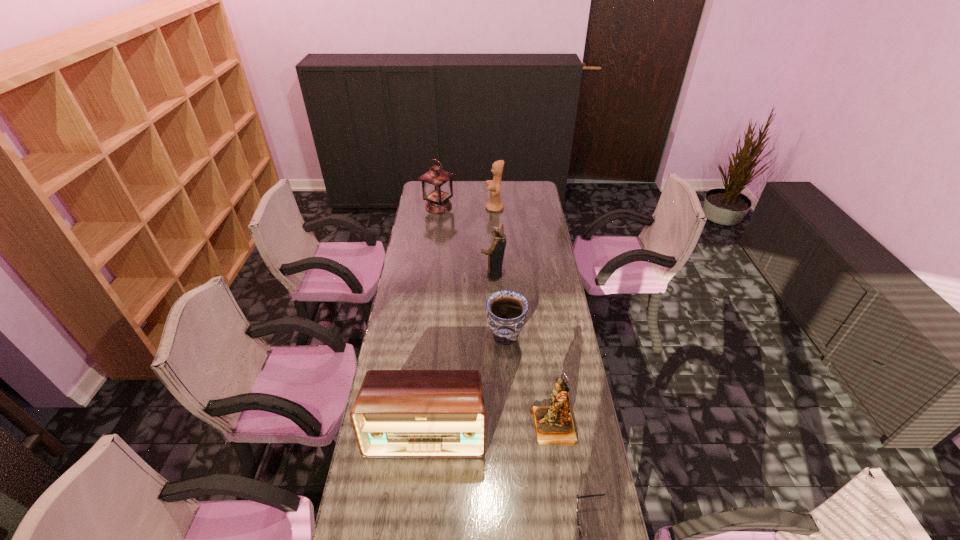
Image resolution: width=960 pixels, height=540 pixels. What are the coordinates of `vacant area between the oil lamp and the radio receiver` in the screenshot? It's located at (432, 320).

The height and width of the screenshot is (540, 960). What are the coordinates of `free spot between the oil lamp and the radio receiver` in the screenshot? It's located at (432, 320).

Where is `vacant space that is in between the radio receiver and the oil lamp`? vacant space that is in between the radio receiver and the oil lamp is located at coordinates (432, 320).

Select which object appears as the fifth closest to the farthest figurine. Please provide its 2D coordinates. Your answer should be formatted as a tuple, i.e. [(x, y)], where the tuple contains the x and y coordinates of a point satisfying the conditions above.

[(397, 413)]

I want to click on object that can be found as the third closest to the radio receiver, so click(x=581, y=539).

Locate an element on the screen. This screenshot has height=540, width=960. figurine that is the second nearest to the farthest figurine is located at coordinates (554, 425).

Identify which figurine is the second closest to the second nearest figurine. Please provide its 2D coordinates. Your answer should be formatted as a tuple, i.e. [(x, y)], where the tuple contains the x and y coordinates of a point satisfying the conditions above.

[(554, 425)]